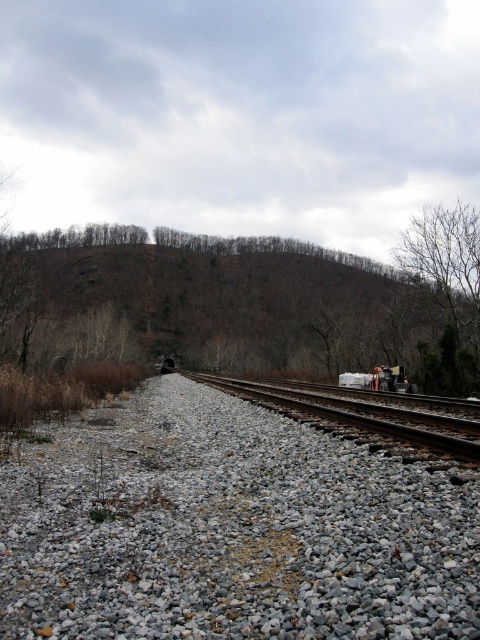
Question: Does gray gravel at center have a larger size compared to bare rock hillside at center?

Choices:
 (A) no
 (B) yes

Answer: (A)

Question: Which point appears farthest from the camera in this image?

Choices:
 (A) (350, 362)
 (B) (264, 387)
 (C) (467, 259)

Answer: (A)

Question: Among these objects, which one is nearest to the camera?

Choices:
 (A) bare branches at right
 (B) smooth metal train track at center

Answer: (B)

Question: Is bare branches at right below white matte train at center-right?

Choices:
 (A) yes
 (B) no

Answer: (B)

Question: Can you confirm if gray gravel at center is positioned above white matte train at center-right?

Choices:
 (A) yes
 (B) no

Answer: (A)

Question: Which is farther from the bare branches at right?

Choices:
 (A) white matte train at center-right
 (B) gray gravel at center
 (C) bare rock hillside at center

Answer: (C)